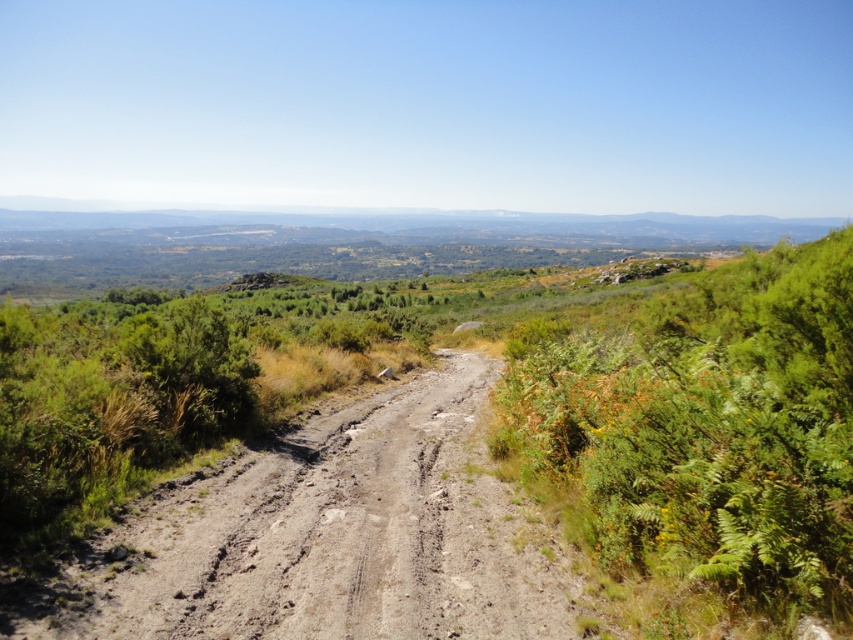
Question: Can you confirm if green leafy shrubs at right is smaller than brown dirt track at center?

Choices:
 (A) no
 (B) yes

Answer: (A)

Question: Which object appears farthest from the camera in this image?

Choices:
 (A) brown dirt track at center
 (B) green leafy shrubs at right

Answer: (A)

Question: Which of the following is the farthest from the observer?

Choices:
 (A) (152, 525)
 (B) (599, 525)

Answer: (A)

Question: Does green leafy shrubs at right appear on the right side of brown dirt track at center?

Choices:
 (A) no
 (B) yes

Answer: (B)

Question: Where is green leafy shrubs at right located in relation to brown dirt track at center in the image?

Choices:
 (A) below
 (B) above

Answer: (B)

Question: Which point is closer to the camera taking this photo?

Choices:
 (A) (817, 499)
 (B) (229, 620)

Answer: (A)